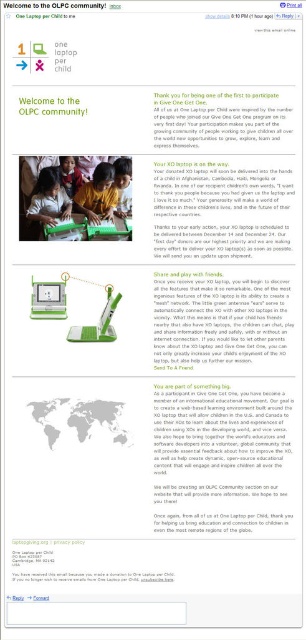
Question: Is the position of black glossy text at lower center more distant than that of matte white computer at center?

Choices:
 (A) no
 (B) yes

Answer: (A)

Question: Which object is closer to the camera taking this photo?

Choices:
 (A) matte black laptop at center
 (B) green text at upper center
 (C) matte white computer at center
 (D) matte green laptop at center

Answer: (D)

Question: Does matte green laptop at center appear over black glossy text at lower center?

Choices:
 (A) no
 (B) yes

Answer: (B)

Question: Which point is closer to the camera?

Choices:
 (A) green text at upper center
 (B) matte white computer at center

Answer: (A)

Question: Which point is farther from the camera taking this photo?

Choices:
 (A) pos(82,336)
 (B) pos(49,292)
 (C) pos(153,580)
 (D) pos(37,308)

Answer: (B)

Question: Is black glossy text at lower center below matte white computer at center?

Choices:
 (A) no
 (B) yes

Answer: (B)